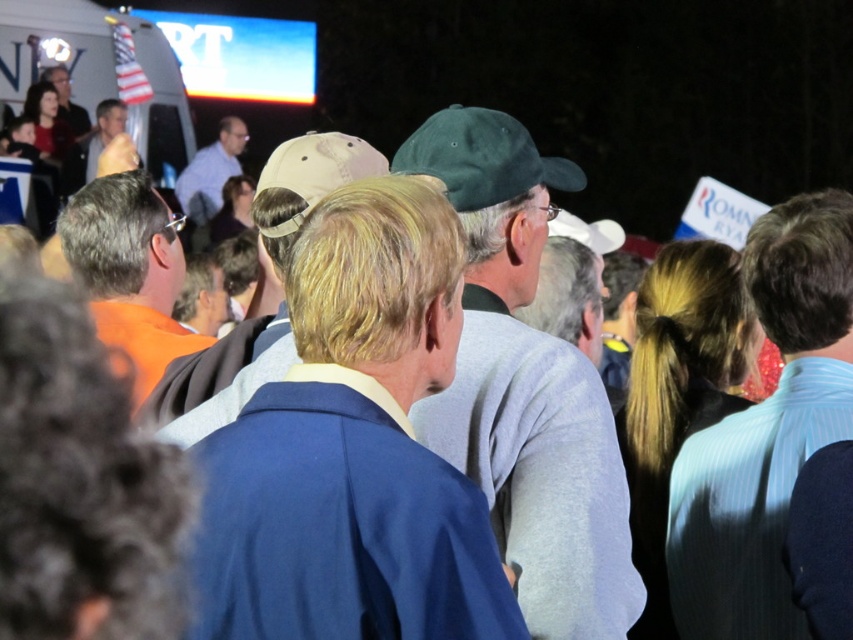
You are standing at the center of the crowd and want to locate the orange fabric shirt at left. According to the spatial coordinates provided, in which direction should you look to find it?

The orange fabric shirt at left is located at point 0.425 in the x coordinate and 0.152 in the y coordinate. Since the x coordinate is 0.425, which is less than 0.5, it means the shirt is to the left of the center. Therefore, you should look to the left to find it.

You are standing at the back of the crowd and want to see the large screen in the background. There are two people blocking your view, the matte blue shirt at center and the light brown leather jacket at center. Which one should you move around to get a better view?

You should move around the light brown leather jacket at center because the matte blue shirt at center is to the right of it, so moving around the light brown leather jacket at center would allow you to see past both.

You are a photographer at the event and want to capture a photo that includes both the orange fabric shirt at left and the matte blue shirt at center. Based on their positions, which shirt should you focus on first to ensure both are in frame?

The orange fabric shirt at left is positioned on the right side of matte blue shirt at center. To capture both in frame, focus on the matte blue shirt at center first as it is closer to the left side, allowing the orange fabric shirt at left to naturally fall into the right side of the frame.